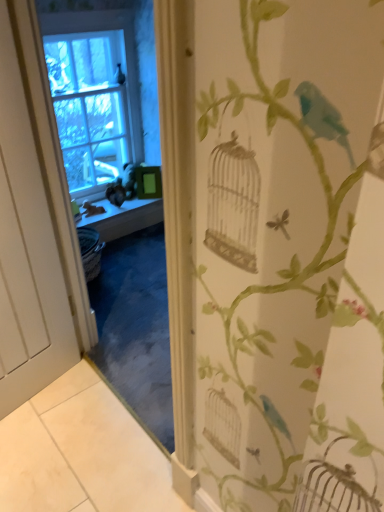
Question: Is white matte door at left oriented towards clear glass window at upper left?

Choices:
 (A) yes
 (B) no

Answer: (B)

Question: Is white matte door at left at the left side of clear glass window at upper left?

Choices:
 (A) yes
 (B) no

Answer: (B)

Question: Is white matte door at left shorter than clear glass window at upper left?

Choices:
 (A) no
 (B) yes

Answer: (A)

Question: Is white matte door at left directly adjacent to clear glass window at upper left?

Choices:
 (A) no
 (B) yes

Answer: (A)

Question: From the image's perspective, is white matte door at left under clear glass window at upper left?

Choices:
 (A) yes
 (B) no

Answer: (A)

Question: Which is correct: white matte door at left is inside smooth wooden window sill at center, or outside of it?

Choices:
 (A) outside
 (B) inside

Answer: (A)

Question: In the image, is white matte door at left positioned in front of or behind smooth wooden window sill at center?

Choices:
 (A) front
 (B) behind

Answer: (A)

Question: Considering the positions of point (6, 69) and point (82, 209), is point (6, 69) closer or farther from the camera than point (82, 209)?

Choices:
 (A) farther
 (B) closer

Answer: (B)

Question: Looking at their shapes, would you say white matte door at left is wider or thinner than smooth wooden window sill at center?

Choices:
 (A) thin
 (B) wide

Answer: (A)

Question: In the image, is clear glass window at upper left on the left side or the right side of white matte door at left?

Choices:
 (A) left
 (B) right

Answer: (A)

Question: Looking at their shapes, would you say clear glass window at upper left is wider or thinner than white matte door at left?

Choices:
 (A) wide
 (B) thin

Answer: (B)

Question: Does point (57, 128) appear closer or farther from the camera than point (57, 352)?

Choices:
 (A) farther
 (B) closer

Answer: (A)

Question: From the image's perspective, is clear glass window at upper left located above or below white matte door at left?

Choices:
 (A) below
 (B) above

Answer: (B)

Question: From their relative heights in the image, would you say clear glass window at upper left is taller or shorter than smooth wooden window sill at center?

Choices:
 (A) tall
 (B) short

Answer: (A)

Question: From the image's perspective, is clear glass window at upper left located above or below smooth wooden window sill at center?

Choices:
 (A) above
 (B) below

Answer: (A)